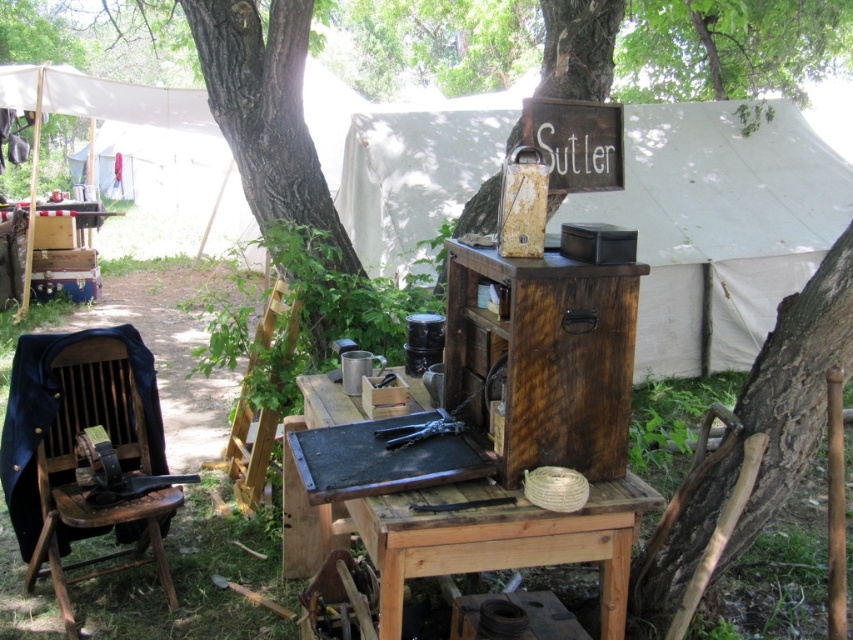
Does brown wood chair at left have a lesser width compared to brown rough bark tree at center?

Correct, brown wood chair at left's width is less than brown rough bark tree at center's.

Does point (90, 404) come closer to viewer compared to point (248, 19)?

Yes, it is.

Is point (49, 404) closer to viewer compared to point (236, 128)?

Yes, point (49, 404) is in front of point (236, 128).

Where is `brown wood chair at left`? brown wood chair at left is located at coordinates (74, 456).

Between point (495, 564) and point (321, 221), which one is positioned in front?

Point (495, 564)

The height and width of the screenshot is (640, 853). What are the coordinates of `rustic wood picnic table at center` in the screenshot? It's located at (473, 538).

Consider the image. Is dark brown wood at lower right to the left of brown rough bark tree at center from the viewer's perspective?

In fact, dark brown wood at lower right is to the right of brown rough bark tree at center.

Does dark brown wood at lower right appear on the right side of brown rough bark tree at center?

Correct, you'll find dark brown wood at lower right to the right of brown rough bark tree at center.

Between point (747, 378) and point (268, 122), which one is positioned behind?

Point (268, 122)

Identify the location of dark brown wood at lower right. (793, 387).